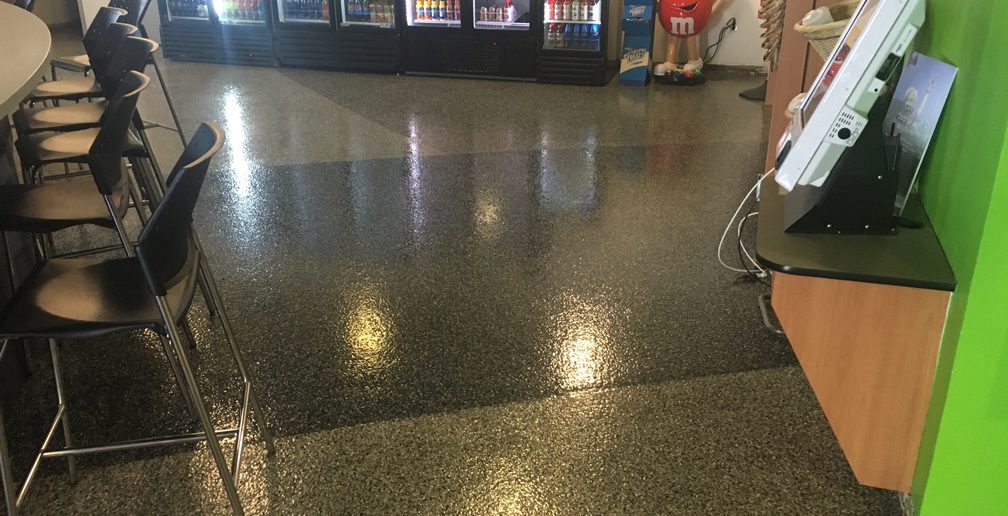
Where is `table`? table is located at coordinates (26, 46).